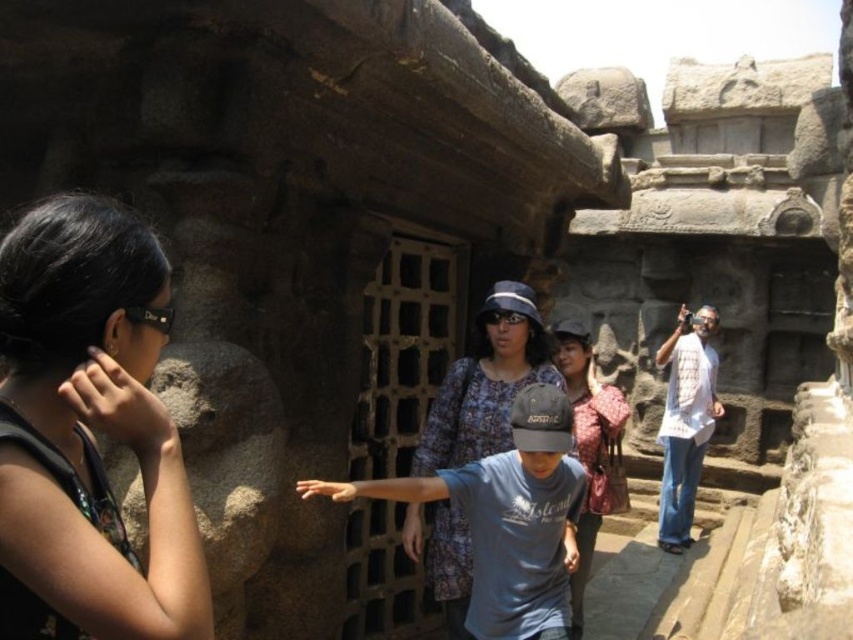
Question: Based on their relative distances, which object is farther from the printed fabric dress at center?

Choices:
 (A) blue denim shirt at center
 (B) black matte sunglasses at left

Answer: (B)

Question: Which of these objects is positioned farthest from the blue denim shirt at center?

Choices:
 (A) white woven shirt at right
 (B) printed fabric dress at center
 (C) black matte sunglasses at left

Answer: (C)

Question: From the image, what is the correct spatial relationship of printed fabric dress at center in relation to white woven shirt at right?

Choices:
 (A) right
 (B) left

Answer: (B)

Question: Does white woven shirt at right appear on the left side of blue denim shirt at center?

Choices:
 (A) no
 (B) yes

Answer: (A)

Question: Can you confirm if black matte sunglasses at left is positioned above printed fabric dress at center?

Choices:
 (A) yes
 (B) no

Answer: (A)

Question: Considering the real-world distances, which object is closest to the white woven shirt at right?

Choices:
 (A) blue denim shirt at center
 (B) printed fabric dress at center
 (C) black matte sunglasses at left

Answer: (A)